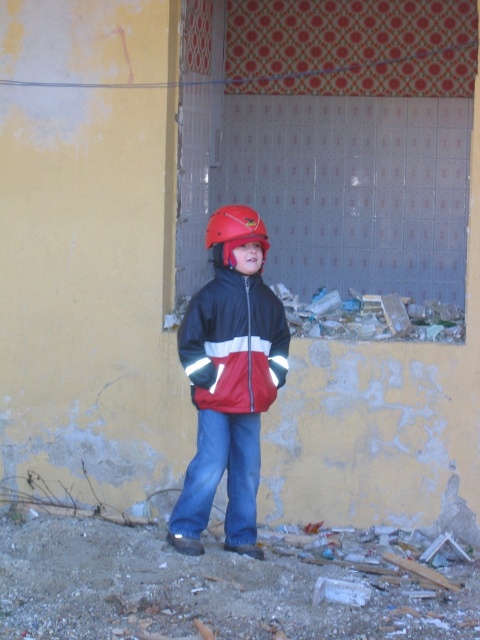
You are a safety inspector assessing the scene. There is broken glass shards at lower center and a matte red helmet at center. How far apart are these two items?

The broken glass shards at lower center are 4.24 feet away from the matte red helmet at center.

You are a photographer positioned at a certain distance from the matte black jacket at center. You want to capture a closeup shot of the jacket without moving closer. Which camera setting adjustment would help you achieve this?

To capture a closeup of the matte black jacket at center from 5.62 meters away without moving closer, you should use a telephoto lens to magnify the subject.